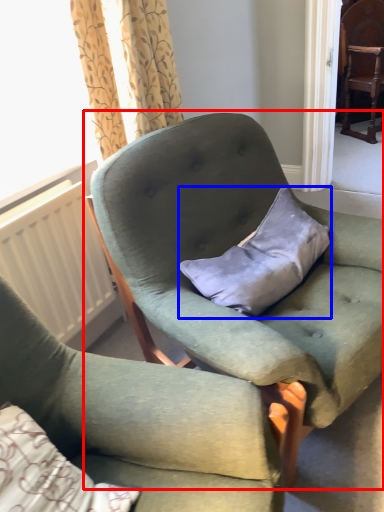
Question: Among these objects, which one is nearest to the camera, chair (highlighted by a red box) or pillow (highlighted by a blue box)?

Choices:
 (A) chair
 (B) pillow

Answer: (A)